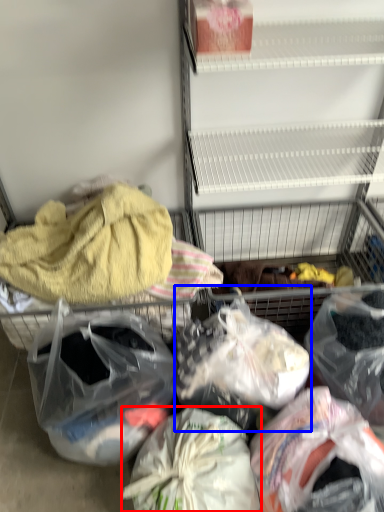
Question: Which of the following is the farthest to the observer, plastic bag (highlighted by a red box) or plastic bag (highlighted by a blue box)?

Choices:
 (A) plastic bag
 (B) plastic bag

Answer: (B)